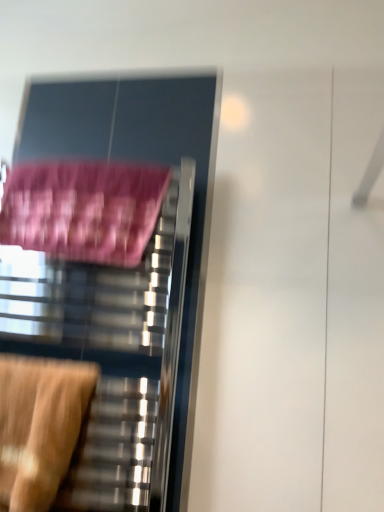
Question: From a real-world perspective, is wooden swivel chair at lower left physically below pink fabric bath towel at left?

Choices:
 (A) no
 (B) yes

Answer: (B)

Question: From the image's perspective, is wooden swivel chair at lower left beneath pink fabric bath towel at left?

Choices:
 (A) yes
 (B) no

Answer: (A)

Question: Is wooden swivel chair at lower left shorter than pink fabric bath towel at left?

Choices:
 (A) no
 (B) yes

Answer: (A)

Question: Is wooden swivel chair at lower left next to pink fabric bath towel at left?

Choices:
 (A) no
 (B) yes

Answer: (A)

Question: Does wooden swivel chair at lower left contain pink fabric bath towel at left?

Choices:
 (A) no
 (B) yes

Answer: (A)

Question: In terms of width, does metallic towel rack at left look wider or thinner when compared to wooden swivel chair at lower left?

Choices:
 (A) thin
 (B) wide

Answer: (A)

Question: From a real-world perspective, is metallic towel rack at left physically located above or below wooden swivel chair at lower left?

Choices:
 (A) above
 (B) below

Answer: (A)

Question: Relative to wooden swivel chair at lower left, is metallic towel rack at left in front or behind?

Choices:
 (A) front
 (B) behind

Answer: (B)

Question: From the image's perspective, is metallic towel rack at left located above or below wooden swivel chair at lower left?

Choices:
 (A) below
 (B) above

Answer: (B)

Question: Considering the relative positions of wooden swivel chair at lower left and metallic towel rack at left in the image provided, is wooden swivel chair at lower left to the left or to the right of metallic towel rack at left?

Choices:
 (A) left
 (B) right

Answer: (A)

Question: From a real-world perspective, is wooden swivel chair at lower left positioned above or below metallic towel rack at left?

Choices:
 (A) above
 (B) below

Answer: (B)

Question: Is wooden swivel chair at lower left taller or shorter than metallic towel rack at left?

Choices:
 (A) short
 (B) tall

Answer: (A)

Question: Is wooden swivel chair at lower left in front of or behind metallic towel rack at left in the image?

Choices:
 (A) front
 (B) behind

Answer: (A)

Question: Would you say pink fabric bath towel at left is to the left or to the right of wooden swivel chair at lower left in the picture?

Choices:
 (A) right
 (B) left

Answer: (A)

Question: Considering the positions of pink fabric bath towel at left and wooden swivel chair at lower left in the image, is pink fabric bath towel at left wider or thinner than wooden swivel chair at lower left?

Choices:
 (A) wide
 (B) thin

Answer: (B)